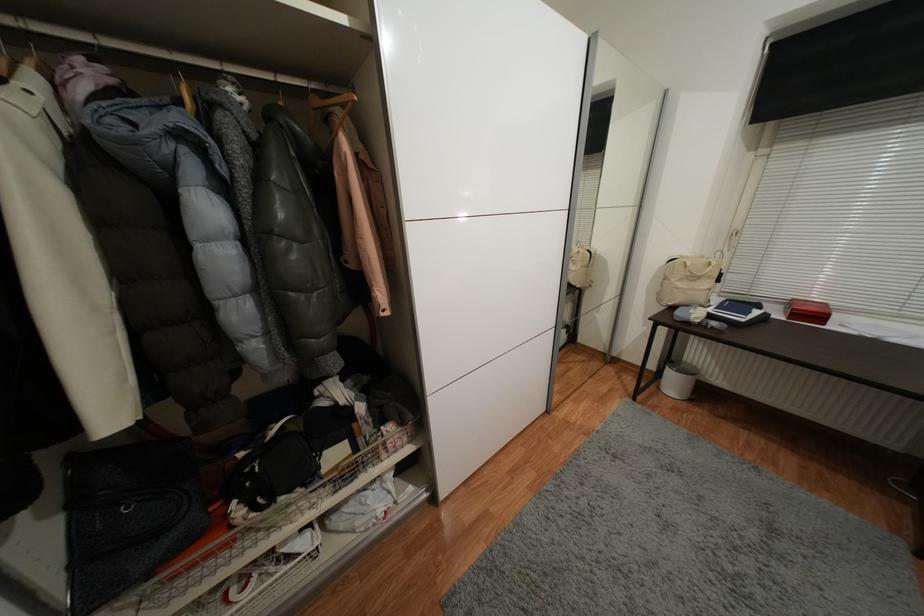
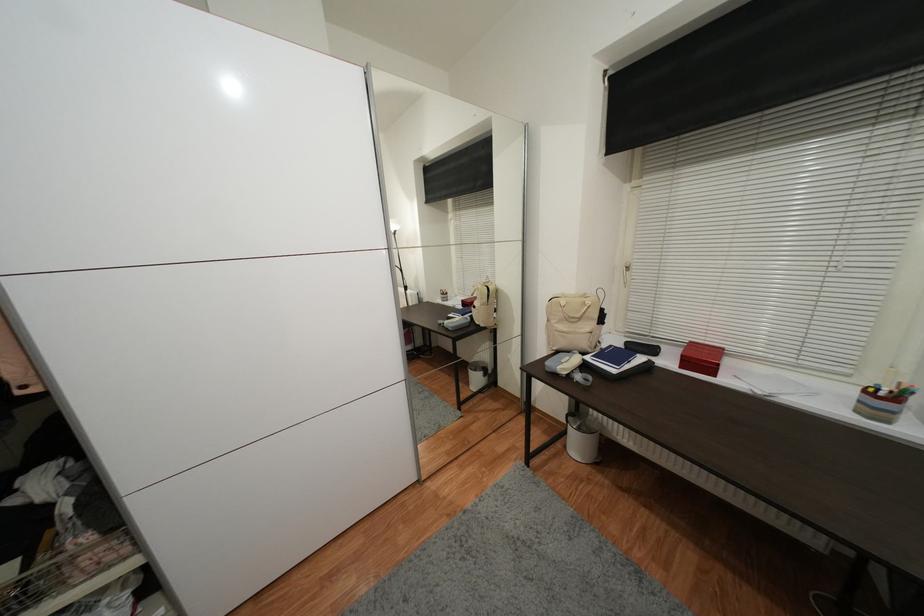
The point at (817, 137) is marked in the first image. Where is the corresponding point in the second image?

(678, 167)